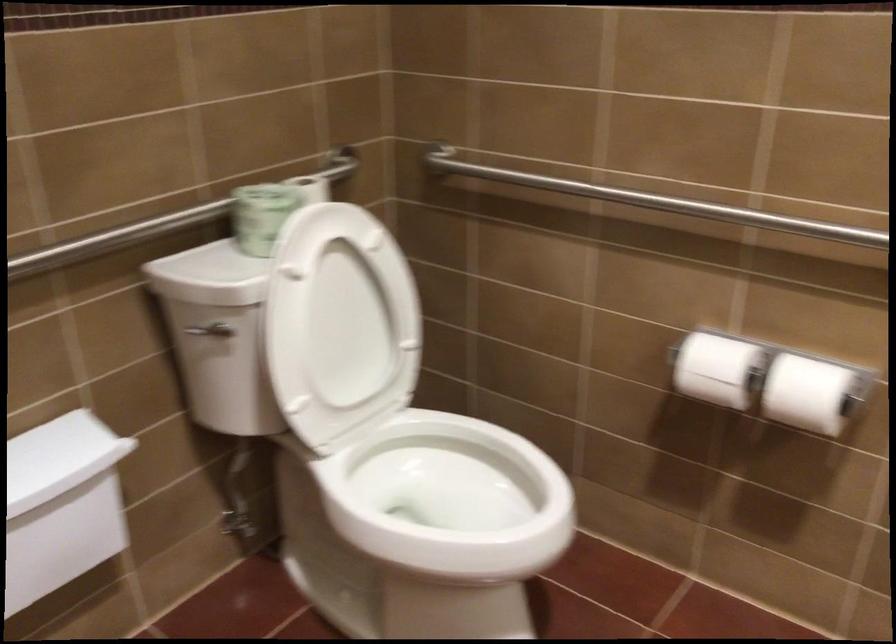
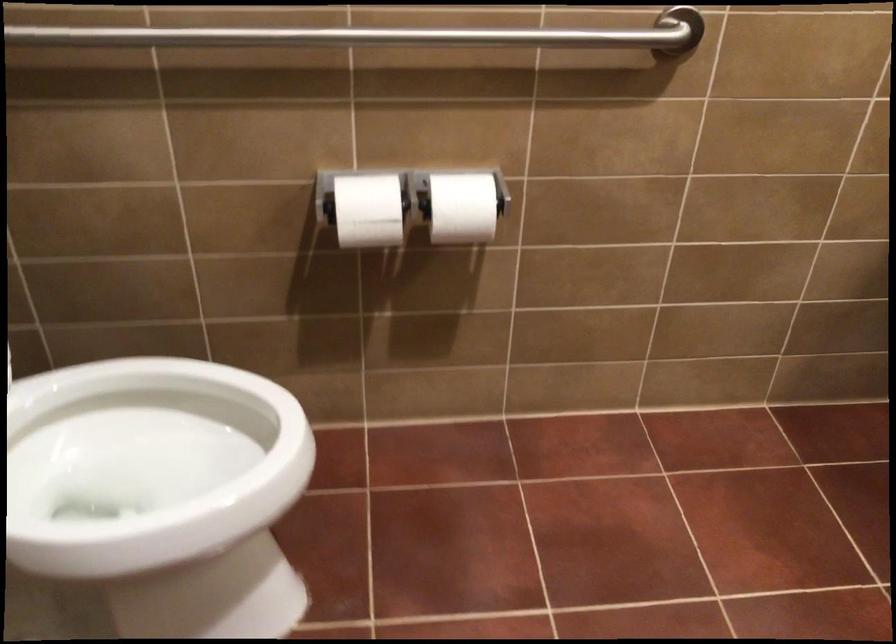
Locate, in the second image, the point that corresponds to (x=460, y=500) in the first image.

(147, 464)